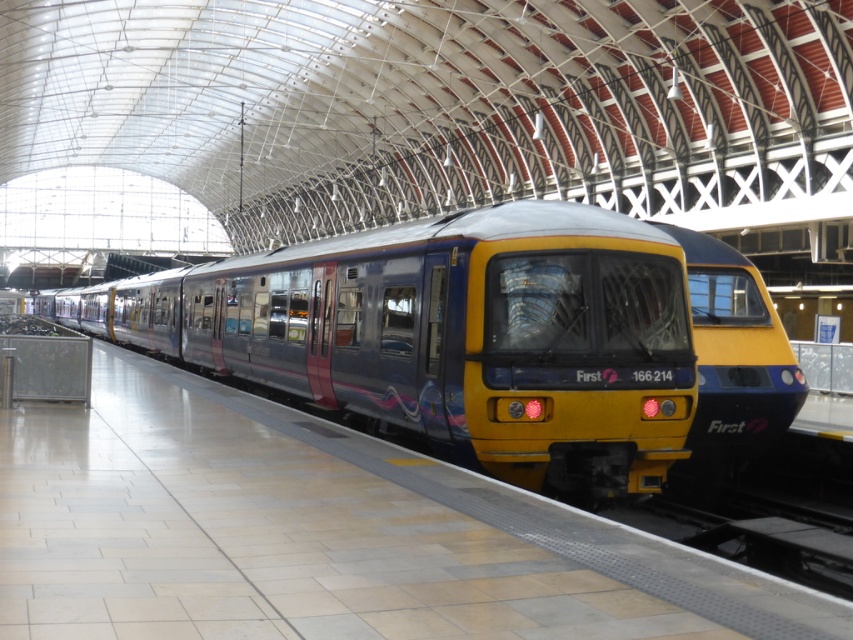
Question: Does metallic blue train at center have a larger size compared to yellow glossy train at center?

Choices:
 (A) yes
 (B) no

Answer: (A)

Question: Considering the relative positions of metallic blue train at center and yellow glossy train at center in the image provided, where is metallic blue train at center located with respect to yellow glossy train at center?

Choices:
 (A) below
 (B) above

Answer: (B)

Question: Which point is closer to the camera?

Choices:
 (A) coord(408,380)
 (B) coord(747,298)

Answer: (A)

Question: Among these objects, which one is farthest from the camera?

Choices:
 (A) metallic blue train at center
 (B) yellow glossy train at center

Answer: (B)

Question: Does metallic blue train at center have a larger size compared to yellow glossy train at center?

Choices:
 (A) yes
 (B) no

Answer: (A)